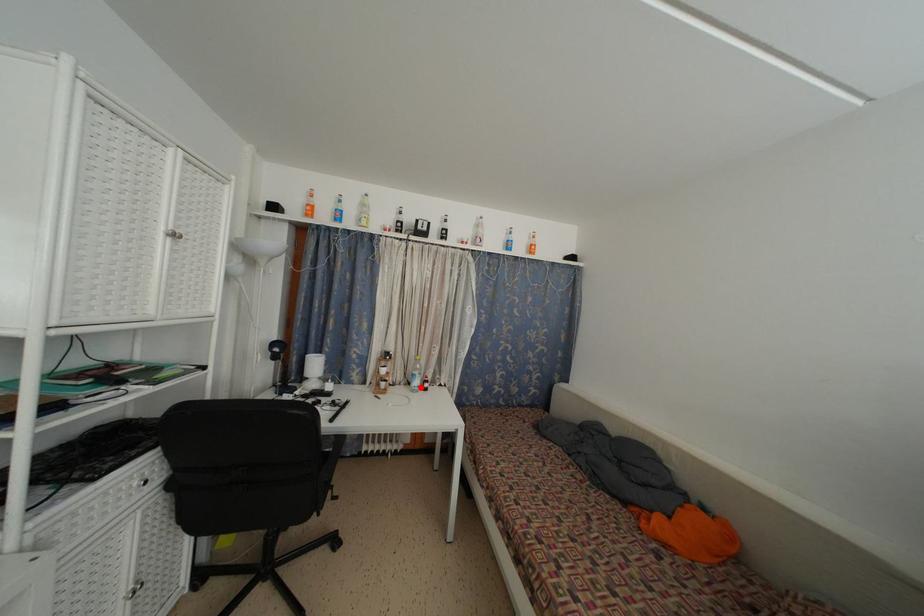
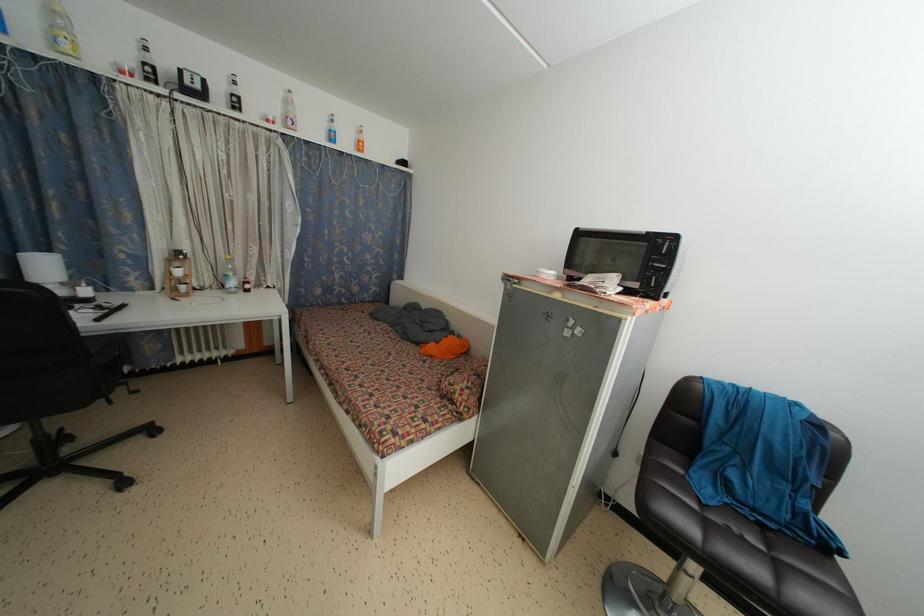
The point at the highlighted location is marked in the first image. Where is the corresponding point in the second image?

(237, 289)